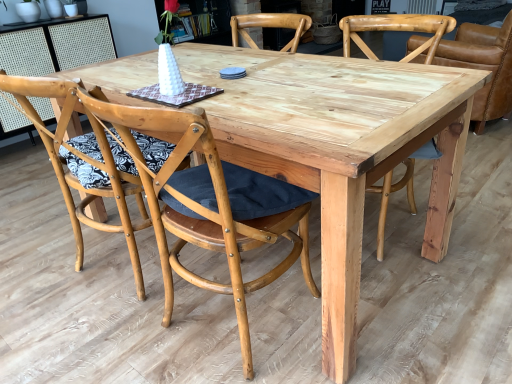
The image size is (512, 384). What are the coordinates of `vacant space underneath natural wood chair at center, acting as the third chair starting from the right (from a real-world perspective)` in the screenshot? It's located at (209, 340).